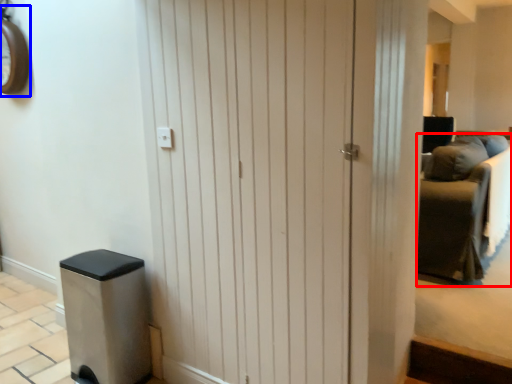
Question: Which point is closer to the camera, furniture (highlighted by a red box) or clock (highlighted by a blue box)?

Choices:
 (A) furniture
 (B) clock

Answer: (A)